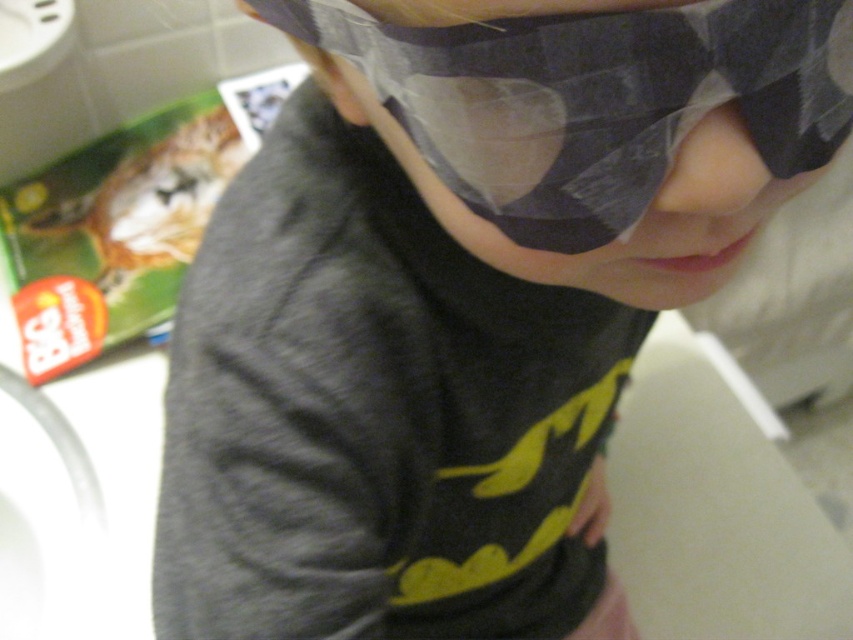
You are a parent trying to ensure your child is comfortable while sleeping. You notice the matte black eye mask at center and the pink smooth skin at center. Which object is positioned higher on the child?

The matte black eye mask at center is above the pink smooth skin at center, so it is positioned higher on the child.

You are a robot trying to navigate through a room. You see two points marked in the scene. Which point is closer to you? The points are point (469, 232) and point (758, 164).

Point (758, 164) is closer to you because it is in front of point (469, 232).